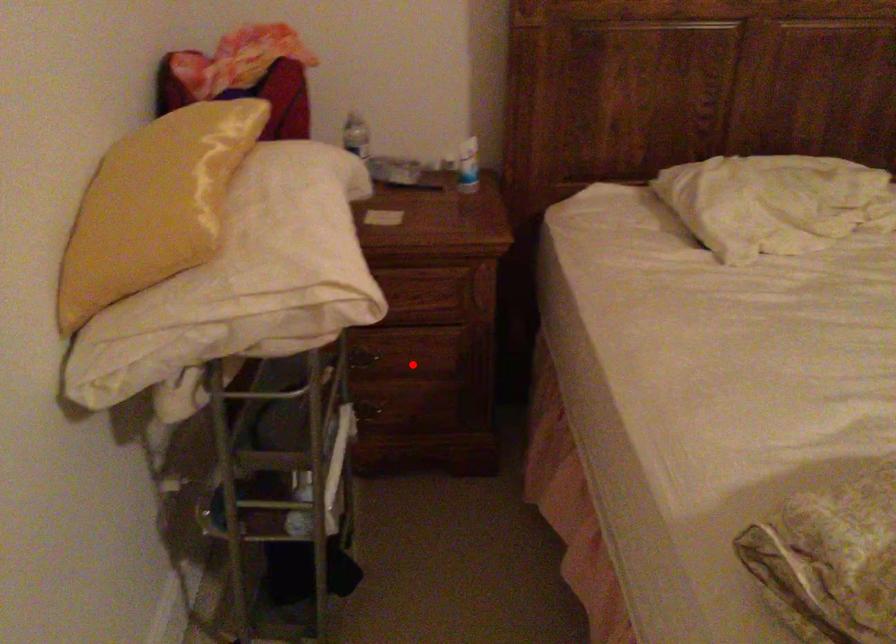
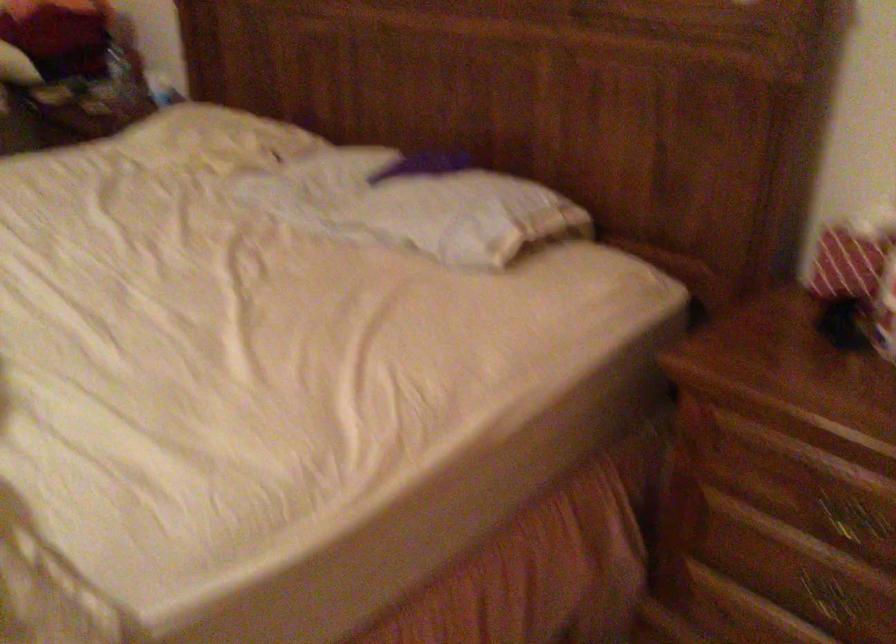
Question: I am providing you with two images of the same scene from different viewpoints. A red point is marked on the first image. At the location where the point appears in image 1, is it still visible in image 2?

Choices:
 (A) Yes
 (B) No

Answer: (B)